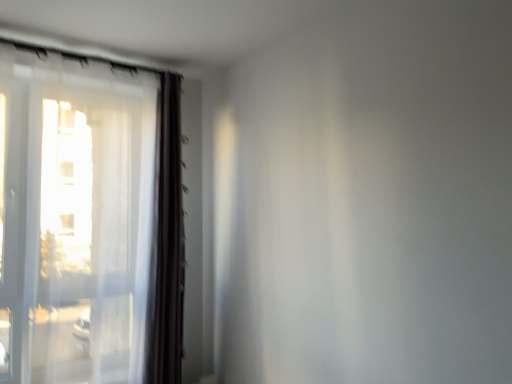
Identify the location of dark brown fabric curtain at left. (166, 243).

The height and width of the screenshot is (384, 512). What do you see at coordinates (166, 243) in the screenshot?
I see `dark brown fabric curtain at left` at bounding box center [166, 243].

You are a GUI agent. You are given a task and a screenshot of the screen. Output one action in this format:
    pyautogui.click(x=<x>, y=<y>)
    Task: Click on the transparent fabric window at left
    
    Given the screenshot: What is the action you would take?
    pyautogui.click(x=89, y=220)

Is dark brown fabric curtain at left aimed at transparent fabric window at left?

No, dark brown fabric curtain at left is not facing towards transparent fabric window at left.

From a real-world perspective, which object rests below the other?

dark brown fabric curtain at left.

Is dark brown fabric curtain at left shorter than transparent fabric window at left?

Yes.

Does dark brown fabric curtain at left have a smaller size compared to transparent fabric window at left?

Yes.

Visually, is dark brown fabric curtain at left positioned to the left or to the right of transparent plastic screen door at left?

From the image, it's evident that dark brown fabric curtain at left is to the right of transparent plastic screen door at left.

From the image's perspective, would you say dark brown fabric curtain at left is positioned over transparent plastic screen door at left?

Result: No, from the image's perspective, dark brown fabric curtain at left is not over transparent plastic screen door at left.

From the picture: Is dark brown fabric curtain at left at the back of transparent fabric window at left?

No, transparent fabric window at left is not facing the opposite direction of dark brown fabric curtain at left.

Considering the sizes of objects transparent fabric window at left and dark brown fabric curtain at left in the image provided, who is thinner, transparent fabric window at left or dark brown fabric curtain at left?

dark brown fabric curtain at left.

Considering the positions of objects transparent fabric window at left and dark brown fabric curtain at left in the image provided, who is in front, transparent fabric window at left or dark brown fabric curtain at left?

Positioned in front is transparent fabric window at left.

Is point (147, 262) closer or farther from the camera than point (163, 293)?

Point (147, 262) appears to be closer to the viewer than point (163, 293).

Is transparent fabric window at left not near transparent plastic screen door at left?

No, transparent fabric window at left is in close proximity to transparent plastic screen door at left.

From the picture: Is transparent fabric window at left inside the boundaries of transparent plastic screen door at left, or outside?

transparent fabric window at left lies outside transparent plastic screen door at left.

Is transparent fabric window at left shorter than transparent plastic screen door at left?

In fact, transparent fabric window at left may be taller than transparent plastic screen door at left.

Which of these two, transparent fabric window at left or transparent plastic screen door at left, is thinner?

transparent fabric window at left.

Is transparent fabric window at left at the back of transparent plastic screen door at left?

That's not correct — transparent plastic screen door at left is not looking away from transparent fabric window at left.

Which object is thinner, transparent plastic screen door at left or transparent fabric window at left?

Thinner between the two is transparent fabric window at left.

Is transparent plastic screen door at left beside transparent fabric window at left?

No, transparent plastic screen door at left is not beside transparent fabric window at left.

Considering the points (15, 251) and (143, 73), which point is behind, point (15, 251) or point (143, 73)?

The point (143, 73) is farther from the camera.

Which is more distant, [19,262] or [152,301]?

The point [152,301] is farther.

Is transparent plastic screen door at left with dark brown fabric curtain at left?

They are not placed beside each other.

At what (x,y) coordinates should I click in order to perform the action: click on screen door to the left of dark brown fabric curtain at left. Please return your answer as a coordinate pair (x, y). The width and height of the screenshot is (512, 384). Looking at the image, I should click on (13, 227).

The height and width of the screenshot is (384, 512). There is a dark brown fabric curtain at left. Find the location of `window above it (from a real-world perspective)`. window above it (from a real-world perspective) is located at coordinates (89, 220).

The height and width of the screenshot is (384, 512). I want to click on curtain lying on the right of transparent plastic screen door at left, so click(166, 243).

Based on the photo, estimate the real-world distances between objects in this image. Which object is further from dark brown fabric curtain at left, transparent fabric window at left or transparent plastic screen door at left?

Among the two, transparent plastic screen door at left is located further to dark brown fabric curtain at left.

Considering their positions, is transparent fabric window at left positioned closer to transparent plastic screen door at left than dark brown fabric curtain at left?

transparent fabric window at left.

Which object lies further to the anchor point transparent fabric window at left, transparent plastic screen door at left or dark brown fabric curtain at left?

transparent plastic screen door at left lies further to transparent fabric window at left than the other object.

Based on their spatial positions, is dark brown fabric curtain at left or transparent plastic screen door at left closer to transparent fabric window at left?

dark brown fabric curtain at left lies closer to transparent fabric window at left than the other object.

Looking at this image, looking at the image, which one is located further to transparent plastic screen door at left, dark brown fabric curtain at left or transparent fabric window at left?

Based on the image, dark brown fabric curtain at left appears to be further to transparent plastic screen door at left.

Looking at the image, which one is located closer to dark brown fabric curtain at left, transparent plastic screen door at left or transparent fabric window at left?

Among the two, transparent fabric window at left is located nearer to dark brown fabric curtain at left.

Image resolution: width=512 pixels, height=384 pixels. I want to click on window between transparent plastic screen door at left and dark brown fabric curtain at left from left to right, so click(x=89, y=220).